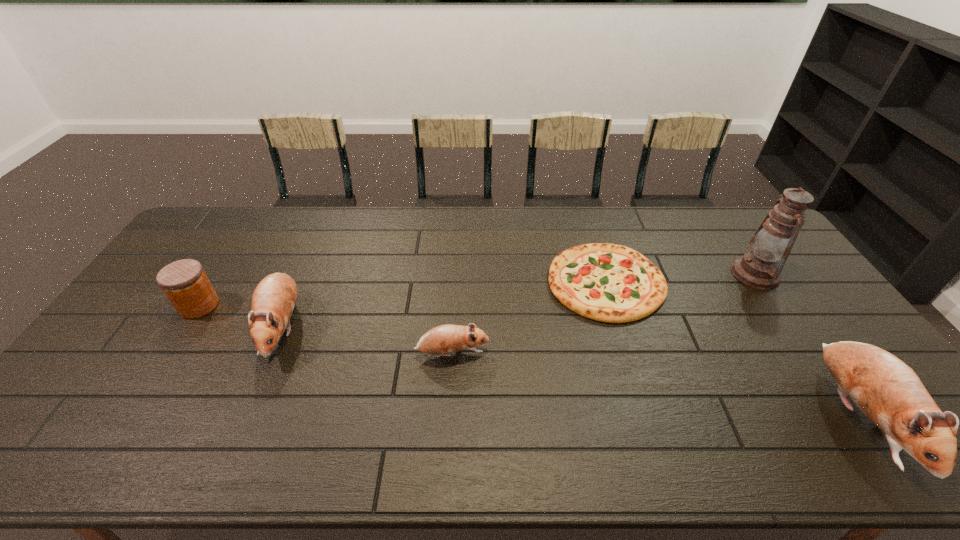
Locate an element on the screen. Image resolution: width=960 pixels, height=540 pixels. the fifth object from right to left is located at coordinates (273, 301).

Locate an element on the screen. Image resolution: width=960 pixels, height=540 pixels. the second tallest hamster is located at coordinates [x=273, y=301].

Image resolution: width=960 pixels, height=540 pixels. I want to click on the second hamster from right to left, so click(x=448, y=338).

The image size is (960, 540). I want to click on the third object from left to right, so click(x=448, y=338).

The width and height of the screenshot is (960, 540). Identify the location of the rightmost hamster. (885, 389).

Locate an element on the screen. Image resolution: width=960 pixels, height=540 pixels. jar is located at coordinates click(x=184, y=282).

This screenshot has width=960, height=540. In order to click on the third object from right to left in this screenshot , I will do `click(611, 283)`.

Locate an element on the screen. This screenshot has width=960, height=540. the shortest object is located at coordinates (611, 283).

This screenshot has width=960, height=540. What are the coordinates of `oil lamp` in the screenshot? It's located at (760, 268).

At what (x,y) coordinates should I click in order to perform the action: click on vacant space situated 0.120m at the face of the leftmost hamster. Please return your answer as a coordinate pair (x, y). Looking at the image, I should click on (246, 411).